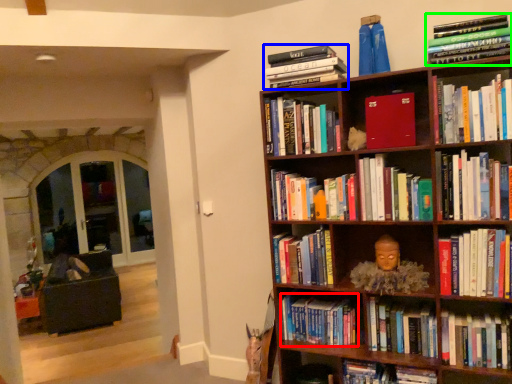
Question: Estimate the real-world distances between objects in this image. Which object is closer to book (highlighted by a red box), book (highlighted by a blue box) or book (highlighted by a green box)?

Choices:
 (A) book
 (B) book

Answer: (A)